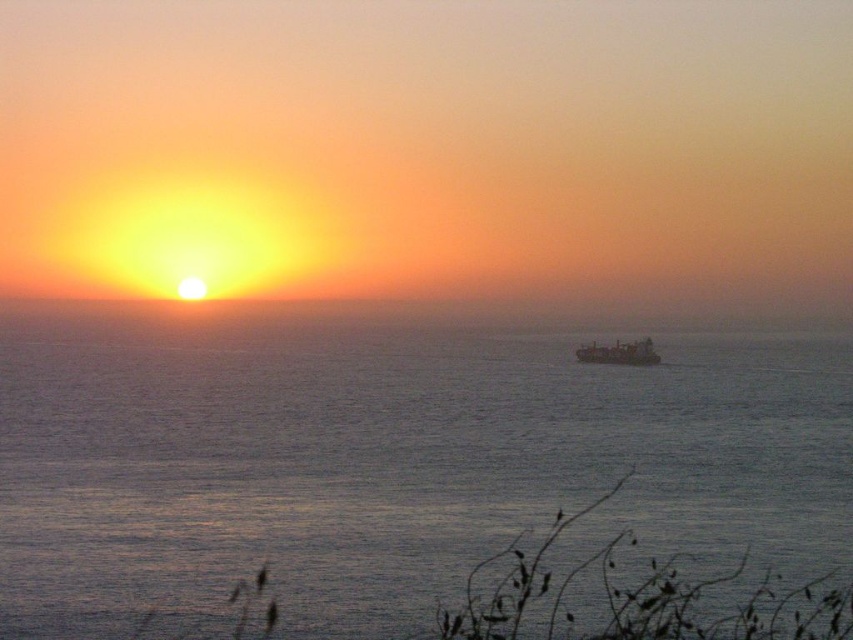
Question: Does blue water at center appear under metallic gray ship at center?

Choices:
 (A) yes
 (B) no

Answer: (A)

Question: Does blue water at center appear on the right side of metallic gray ship at center?

Choices:
 (A) no
 (B) yes

Answer: (A)

Question: Is the position of blue water at center less distant than that of metallic gray ship at center?

Choices:
 (A) yes
 (B) no

Answer: (A)

Question: Among these objects, which one is farthest from the camera?

Choices:
 (A) metallic gray ship at center
 (B) blue water at center

Answer: (A)